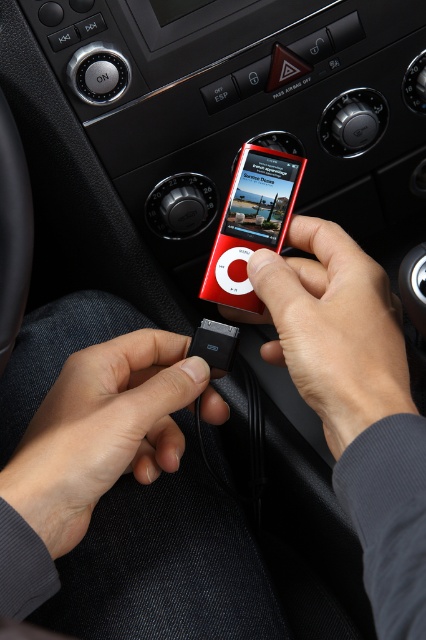
You are a passenger in the car and want to know where the matte red ipod at center is located relative to the driver. Can you describe its position using coordinates?

The matte red ipod at center is located at coordinates point [331,328].

You are a passenger in the car and want to connect your red iPod to the car audio system. The car has a USB port located at point 0.672, 0.246. Can you reach the black matte usb cable at lower center from your seat?

The black matte usb cable at lower center is located at point (104, 429), which matches the location of the USB port. Therefore, you can reach the black matte usb cable at lower center from your seat to connect the iPod.

You are a passenger in the car and want to grab the matte red ipod at center to play a song. Which direction should you move your hand from the red glossy ipod at center to reach it?

The matte red ipod at center is to the right of the red glossy ipod at center, so you should move your hand to the right to reach it.